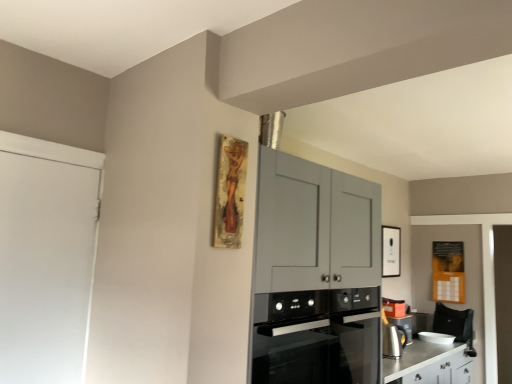
Question: Can you confirm if white matte door at left is shorter than satin silver kettle at lower right, which is the second appliance from bottom to top?

Choices:
 (A) no
 (B) yes

Answer: (A)

Question: Can you confirm if white matte door at left is thinner than satin silver kettle at lower right, which is counted as the 1th appliance, starting from the top?

Choices:
 (A) yes
 (B) no

Answer: (A)

Question: Is satin silver kettle at lower right, marked as the second appliance in a back-to-front arrangement, at the back of white matte door at left?

Choices:
 (A) no
 (B) yes

Answer: (A)

Question: From a real-world perspective, is white matte door at left physically below satin silver kettle at lower right, which is the second appliance from bottom to top?

Choices:
 (A) no
 (B) yes

Answer: (A)

Question: Does white matte door at left appear on the right side of satin silver kettle at lower right, which is the second appliance from right to left?

Choices:
 (A) no
 (B) yes

Answer: (A)

Question: Is point (382, 374) positioned closer to the camera than point (53, 230)?

Choices:
 (A) closer
 (B) farther

Answer: (B)

Question: Is silver metallic counter at lower right in front of or behind white matte door at left in the image?

Choices:
 (A) behind
 (B) front

Answer: (A)

Question: From their relative heights in the image, would you say silver metallic counter at lower right is taller or shorter than white matte door at left?

Choices:
 (A) tall
 (B) short

Answer: (B)

Question: From a real-world perspective, is silver metallic counter at lower right positioned above or below white matte door at left?

Choices:
 (A) below
 (B) above

Answer: (A)

Question: Does point (317, 367) appear closer or farther from the camera than point (463, 359)?

Choices:
 (A) closer
 (B) farther

Answer: (A)

Question: Relative to silver metallic counter at lower right, is black glass oven at center in front or behind?

Choices:
 (A) front
 (B) behind

Answer: (A)

Question: From a real-world perspective, is black glass oven at center positioned above or below silver metallic counter at lower right?

Choices:
 (A) below
 (B) above

Answer: (B)

Question: From the image's perspective, is black glass oven at center positioned above or below silver metallic counter at lower right?

Choices:
 (A) below
 (B) above

Answer: (B)

Question: From a real-world perspective, relative to silver metallic counter at lower right, is satin silver kettle at lower right, which is counted as the 1th appliance, starting from the top, vertically above or below?

Choices:
 (A) above
 (B) below

Answer: (A)

Question: Does point (384, 350) appear closer or farther from the camera than point (424, 349)?

Choices:
 (A) closer
 (B) farther

Answer: (A)